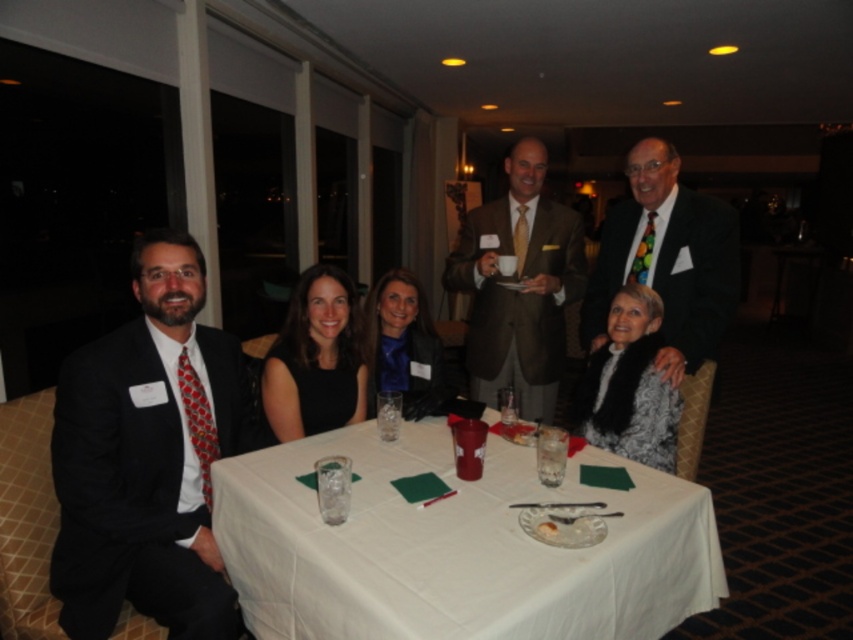
You are a waiter at a formal event. You need to deliver a dessert plate that is 1.5 feet wide to the table. The dessert plate must be placed between the white cloth at center and the matte brown suit at center. Is there enough space between them to place the dessert plate?

The white cloth at center is 3.59 feet away from the matte brown suit at center. Since the dessert plate is 1.5 feet wide, there is sufficient space between them to place the dessert plate.

You are organizing a photo shoot and need to position a spotlight on the matte black suit at left and the multicolored tie at upper right. Since the spotlight can only cover one object at a time, which object requires a smaller spotlight area?

The matte black suit at left requires a smaller spotlight area because it occupies less space than the multicolored tie at upper right.

You are standing in the room where the event is happening. There is a point at coordinates point (196, 404). Can you reach that point without moving more than 6 feet from your current position?

The point at coordinates point (196, 404) is 5.97 feet away from you, so yes, you can reach it without moving more than 6 feet from your current position.